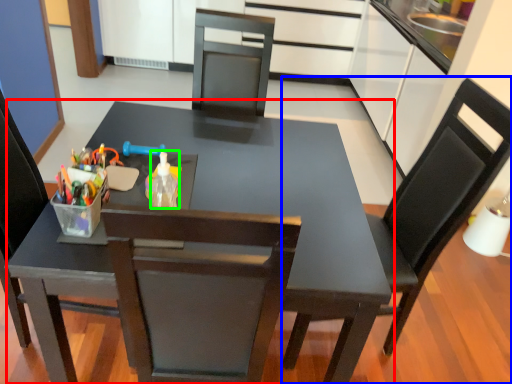
Question: Estimate the real-world distances between objects in this image. Which object is closer to table (highlighted by a red box), chair (highlighted by a blue box) or bottle (highlighted by a green box)?

Choices:
 (A) chair
 (B) bottle

Answer: (B)